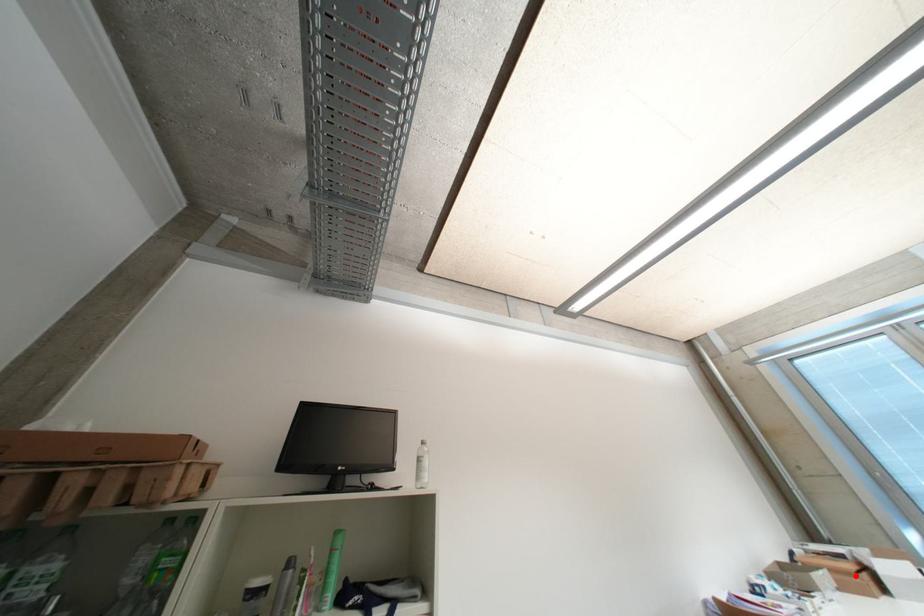
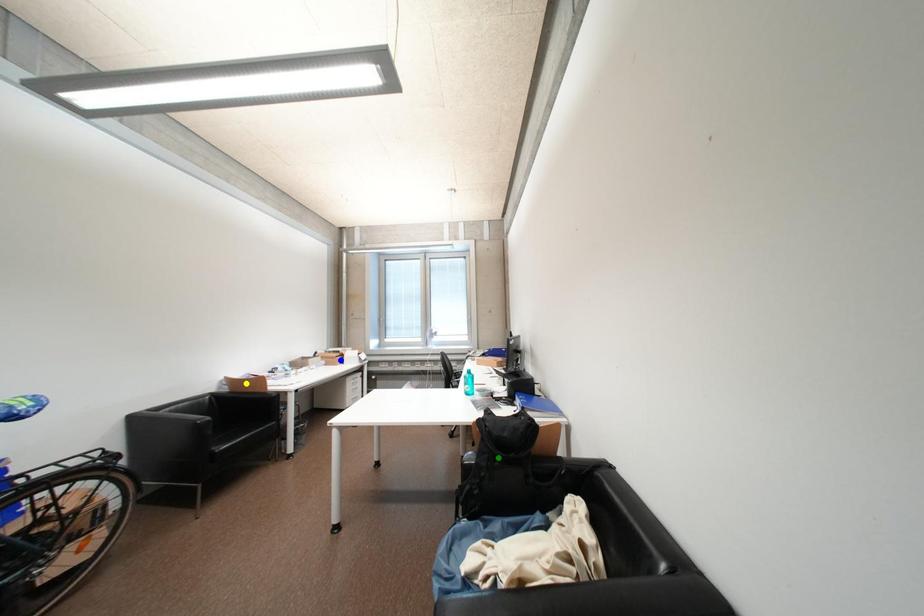
Question: I am providing you with two images of the same scene from different viewpoints. A red point is marked on the first image. You are given multiple points on the second image. Which point in image 2 represents the same 3d spot as the red point in image 1?

Choices:
 (A) blue point
 (B) yellow point
 (C) green point

Answer: (A)